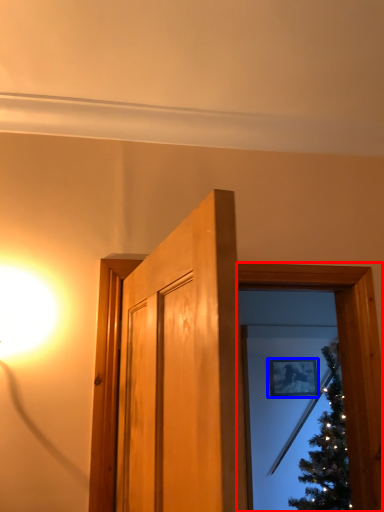
Question: Which point is closer to the camera, window frame (highlighted by a red box) or picture frame (highlighted by a blue box)?

Choices:
 (A) window frame
 (B) picture frame

Answer: (A)